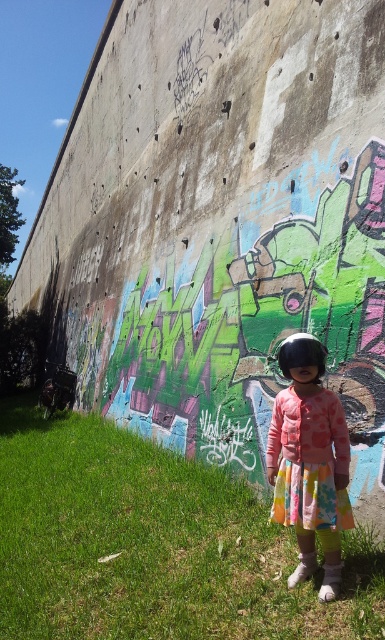
Can you confirm if green grass at lower left is taller than matte pink dress at center?

Incorrect, green grass at lower left's height is not larger of matte pink dress at center's.

Is green grass at lower left closer to the viewer compared to matte pink dress at center?

That is True.

Which is behind, point (148, 548) or point (309, 339)?

Point (148, 548)

I want to click on green grass at lower left, so click(152, 545).